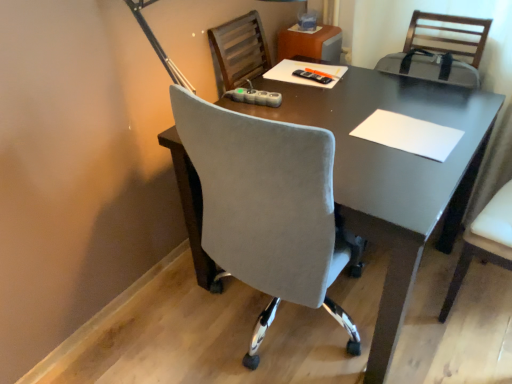
Question: Considering the positions of point (328, 77) and point (450, 142), is point (328, 77) closer or farther from the camera than point (450, 142)?

Choices:
 (A) farther
 (B) closer

Answer: (A)

Question: From a real-world perspective, is black plastic remote control at center physically located above or below white paper at center?

Choices:
 (A) below
 (B) above

Answer: (B)

Question: Which object is positioned farthest from the black plastic remote control at center?

Choices:
 (A) white leather chair at right
 (B) white paper at center

Answer: (A)

Question: Estimate the real-world distances between objects in this image. Which object is closer to the black plastic remote control at center?

Choices:
 (A) white leather chair at right
 (B) white paper at center

Answer: (B)